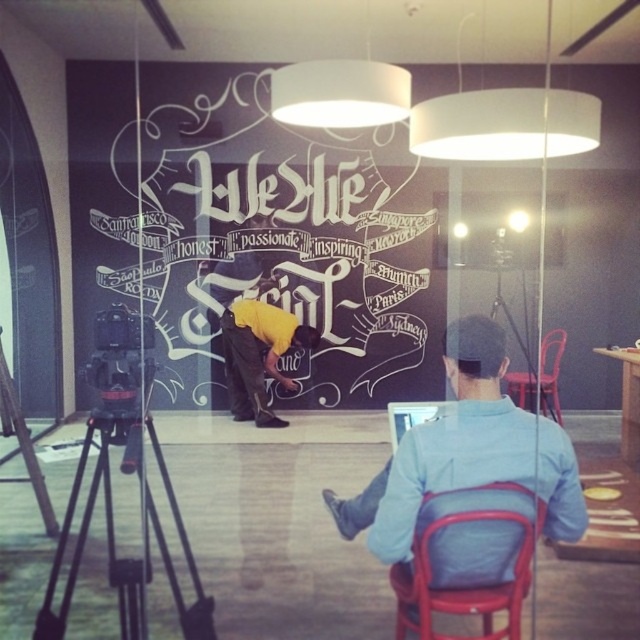
You are a photographer setting up for a shoot. You have a white chalkboard at center and a black metal tripod at lower left. Which object should you focus on first if you want to capture the entire scene in one frame?

The white chalkboard at center is bigger than the black metal tripod at lower left, so you should focus on the white chalkboard at center first to ensure it is centered and properly framed before adjusting for the smaller tripod.

You are a photographer setting up for a shoot. You need to ensure that the white chalkboard at center is visible in the camera frame without obstruction from the black metal tripod at lower left. Given their height difference, will the tripod block the chalkboard?

The white chalkboard at center is taller than the black metal tripod at lower left, so the tripod will not block the chalkboard as it is shorter.

You are standing in front of the chalkboard wall and see the point marked at coordinates (259, 355). What object is located at that point?

The point at coordinates (259, 355) corresponds to the yellow matte shirt at center.